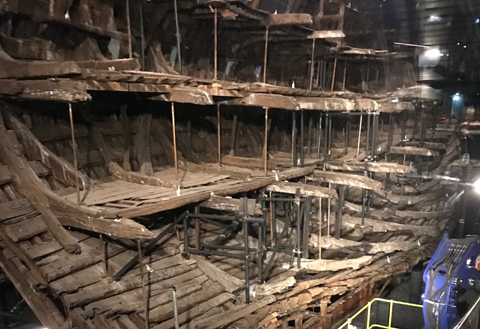
The width and height of the screenshot is (480, 329). Find the location of `beams`. beams is located at coordinates (176, 155).